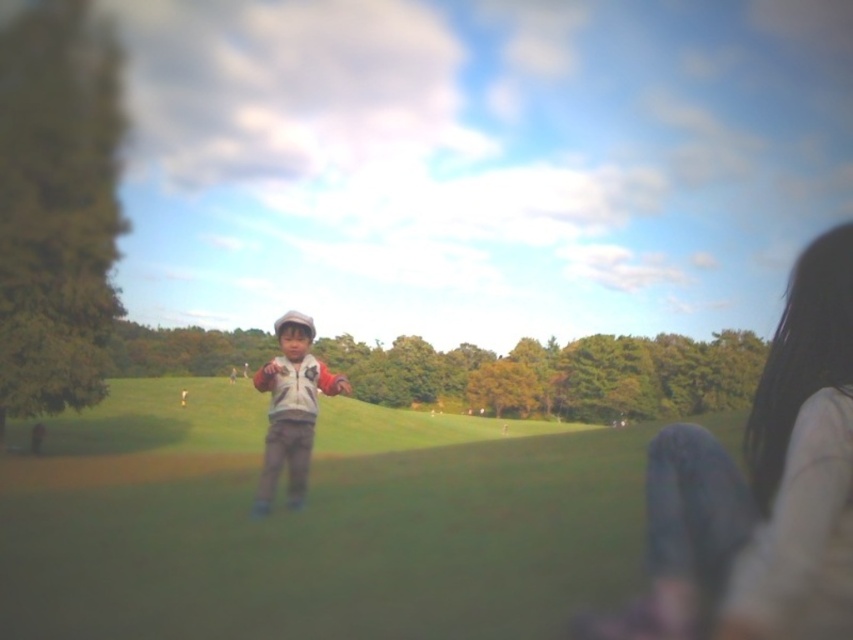
Question: Which point is closer to the camera taking this photo?

Choices:
 (A) (306, 353)
 (B) (763, 570)

Answer: (B)

Question: Observing the image, what is the correct spatial positioning of denim pants at lower right in reference to matte gray jacket at center?

Choices:
 (A) left
 (B) right

Answer: (B)

Question: Does denim pants at lower right appear on the left side of matte gray jacket at center?

Choices:
 (A) no
 (B) yes

Answer: (A)

Question: Which of the following is the closest to the observer?

Choices:
 (A) (306, 477)
 (B) (659, 566)

Answer: (B)

Question: Does denim pants at lower right appear under matte gray jacket at center?

Choices:
 (A) yes
 (B) no

Answer: (B)

Question: Which object is farther from the camera taking this photo?

Choices:
 (A) matte gray jacket at center
 (B) denim pants at lower right

Answer: (A)